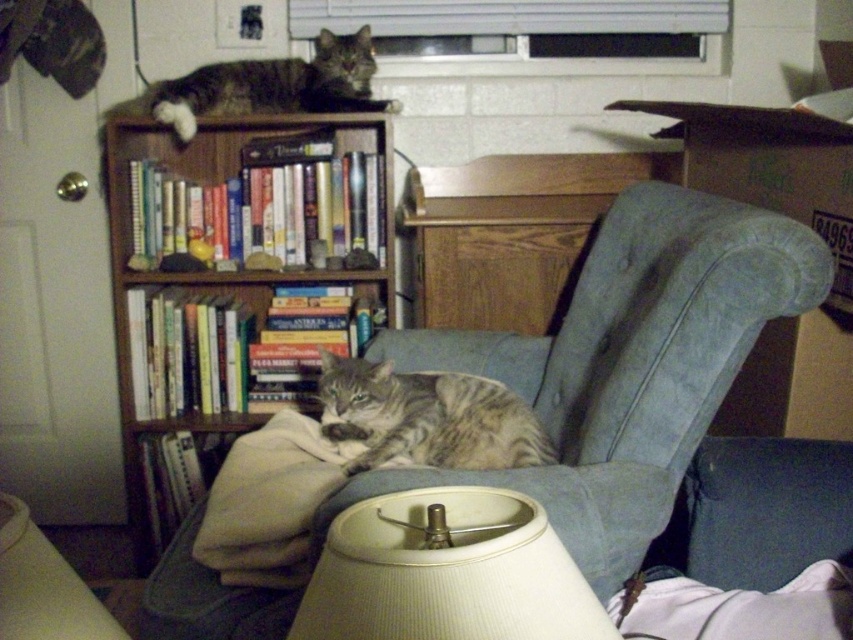
Is wooden bookshelf at upper left to the left of tabby fur cat at upper left from the viewer's perspective?

Correct, you'll find wooden bookshelf at upper left to the left of tabby fur cat at upper left.

Which is in front, point (392, 310) or point (283, 68)?

Point (283, 68)

Identify the location of wooden bookshelf at upper left. The height and width of the screenshot is (640, 853). (213, 269).

Who is lower down, velvet blue armchair at center or beige ribbed lampshade at lower center?

Positioned lower is beige ribbed lampshade at lower center.

Between velvet blue armchair at center and beige ribbed lampshade at lower center, which one is positioned higher?

velvet blue armchair at center

What do you see at coordinates (631, 360) in the screenshot?
I see `velvet blue armchair at center` at bounding box center [631, 360].

You are a GUI agent. You are given a task and a screenshot of the screen. Output one action in this format:
    pyautogui.click(x=<x>, y=<y>)
    Task: Click on the velvet blue armchair at center
    
    Given the screenshot: What is the action you would take?
    pyautogui.click(x=631, y=360)

Consider the image. Between velvet blue armchair at center and wooden bookshelf at upper left, which one is positioned lower?

velvet blue armchair at center

Can you confirm if velvet blue armchair at center is thinner than wooden bookshelf at upper left?

No, velvet blue armchair at center is not thinner than wooden bookshelf at upper left.

What do you see at coordinates (631, 360) in the screenshot?
I see `velvet blue armchair at center` at bounding box center [631, 360].

This screenshot has height=640, width=853. What are the coordinates of `velvet blue armchair at center` in the screenshot? It's located at (631, 360).